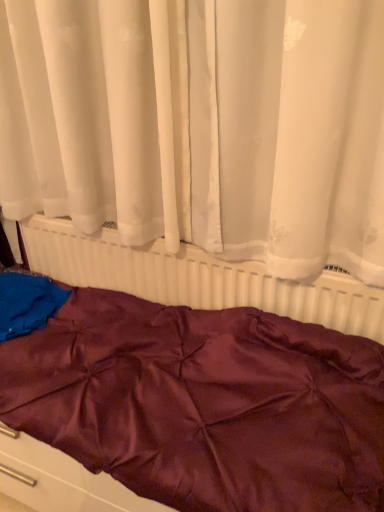
Question: Is white plastic radiator at center bigger or smaller than burgundy satin bedspread at center?

Choices:
 (A) big
 (B) small

Answer: (B)

Question: Considering the positions of white plastic radiator at center and burgundy satin bedspread at center in the image, is white plastic radiator at center taller or shorter than burgundy satin bedspread at center?

Choices:
 (A) tall
 (B) short

Answer: (A)

Question: Which is nearer to the burgundy satin bedspread at center?

Choices:
 (A) white sheer curtain at upper center
 (B) white plastic radiator at center

Answer: (B)

Question: Which object is the farthest from the white plastic radiator at center?

Choices:
 (A) burgundy satin bedspread at center
 (B) white sheer curtain at upper center

Answer: (B)